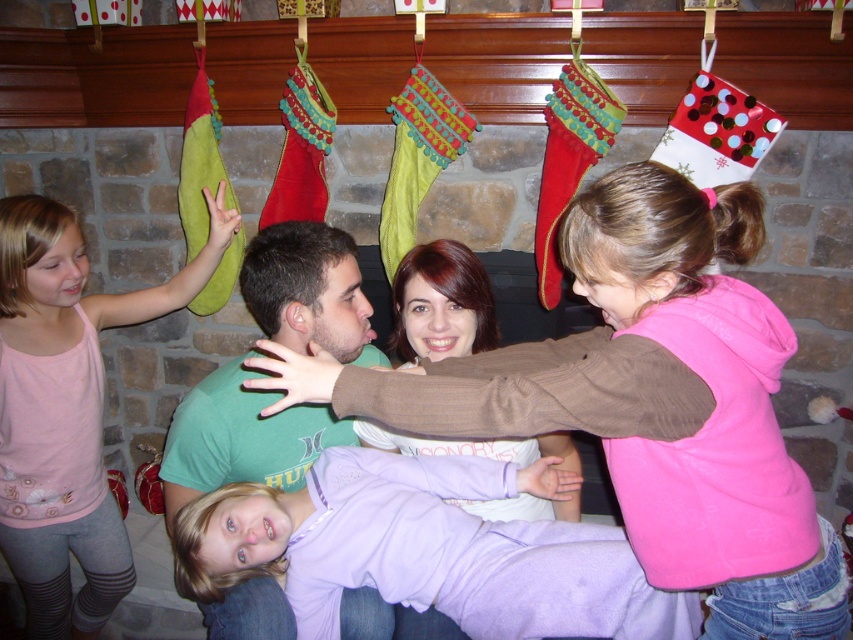
Does pink fleece hoodie at upper right lie in front of pink fabric dress at left?

Yes, pink fleece hoodie at upper right is closer to the viewer.

Is pink fleece hoodie at upper right to the right of pink fabric dress at left from the viewer's perspective?

Yes, pink fleece hoodie at upper right is to the right of pink fabric dress at left.

Which is behind, point (569, 410) or point (10, 538)?

Point (10, 538)

The image size is (853, 640). I want to click on pink fleece hoodie at upper right, so pos(643,401).